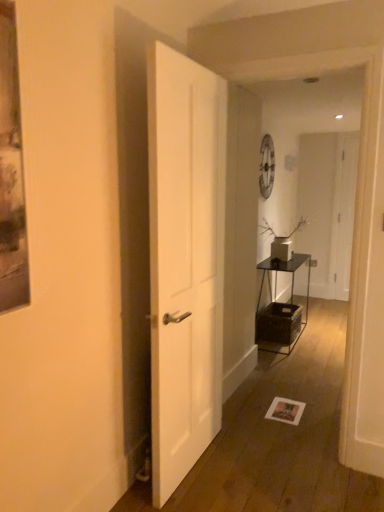
Question: Is point (261, 342) positioned closer to the camera than point (297, 224)?

Choices:
 (A) closer
 (B) farther

Answer: (A)

Question: Relative to white matte vase at center-right, is metallic black table at center-right in front or behind?

Choices:
 (A) behind
 (B) front

Answer: (B)

Question: Which of these objects is positioned closest to the white matte door at right, the second door viewed from the front?

Choices:
 (A) metallic black table at center-right
 (B) white matte door at center, marked as the 1th door in a left-to-right arrangement
 (C) white matte vase at center-right

Answer: (A)

Question: Considering the real-world distances, which object is closest to the white matte door at right, the second door viewed from the front?

Choices:
 (A) metallic black table at center-right
 (B) white matte vase at center-right
 (C) white matte door at center, arranged as the 2th door when viewed from the right

Answer: (A)